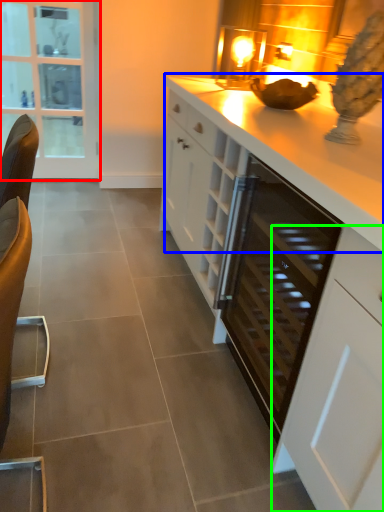
Question: Considering the real-world distances, which object is farthest from glass door (highlighted by a red box)? countertop (highlighted by a blue box) or cabinetry (highlighted by a green box)?

Choices:
 (A) countertop
 (B) cabinetry

Answer: (B)